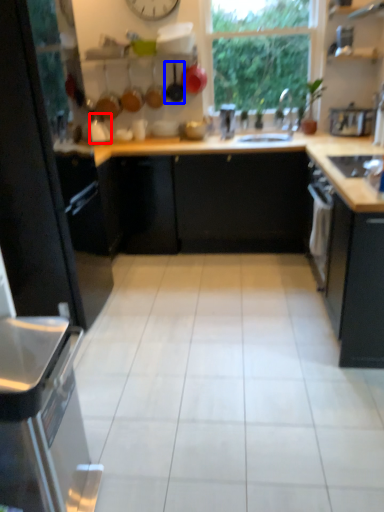
Question: Which object is further to the camera taking this photo, appliance (highlighted by a red box) or frying pan (highlighted by a blue box)?

Choices:
 (A) appliance
 (B) frying pan

Answer: (B)